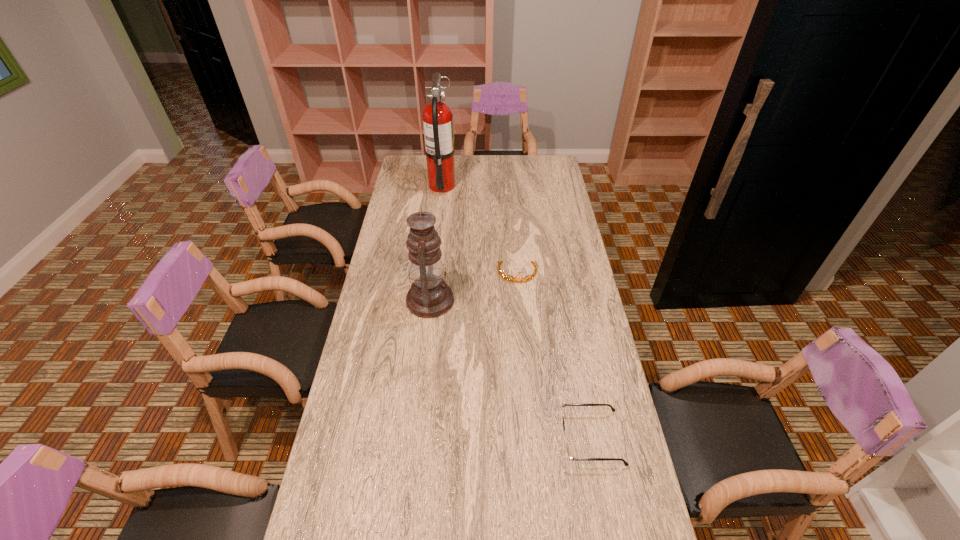
Locate an element on the screen. The height and width of the screenshot is (540, 960). vacant space at the right edge of the desktop is located at coordinates (635, 509).

The image size is (960, 540). Identify the location of vacant space at the far left corner of the desktop. pos(421,174).

Locate an element on the screen. This screenshot has width=960, height=540. vacant space at the far right corner is located at coordinates (549, 155).

I want to click on free space between the oil lamp and the second shortest object, so click(x=474, y=287).

This screenshot has width=960, height=540. I want to click on empty location between the second shortest object and the tallest object, so click(480, 230).

Image resolution: width=960 pixels, height=540 pixels. Find the location of `unoccupied position between the rightmost object and the oil lamp`. unoccupied position between the rightmost object and the oil lamp is located at coordinates (511, 369).

Where is `vacant area between the rightmost object and the second shortest object`? Image resolution: width=960 pixels, height=540 pixels. vacant area between the rightmost object and the second shortest object is located at coordinates (554, 356).

This screenshot has height=540, width=960. What are the coordinates of `empty location between the oil lamp and the nearest object` in the screenshot? It's located at (511, 369).

I want to click on empty space between the tiara and the spectacles, so click(554, 356).

Where is `vacant space that is in between the second tallest object and the tiara`? vacant space that is in between the second tallest object and the tiara is located at coordinates (474, 287).